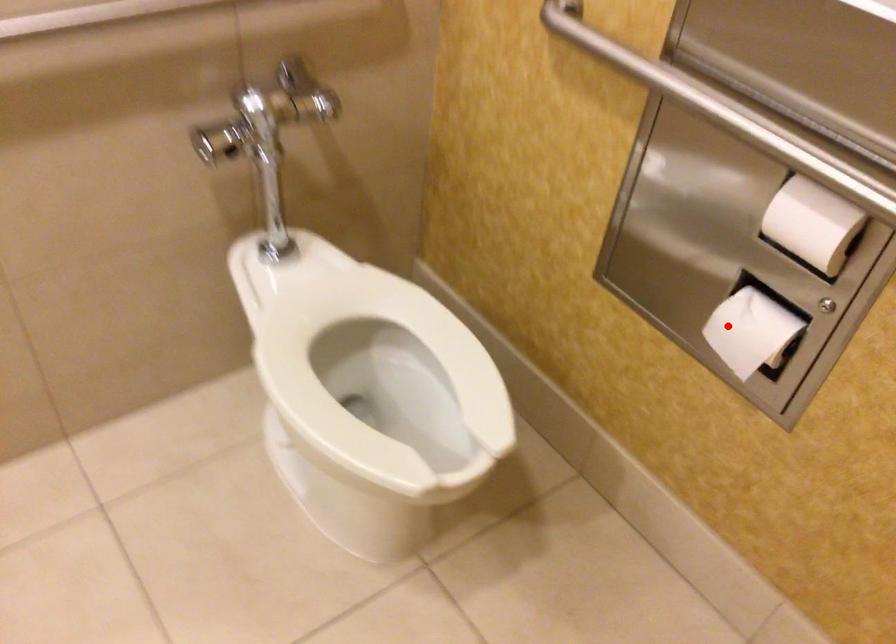
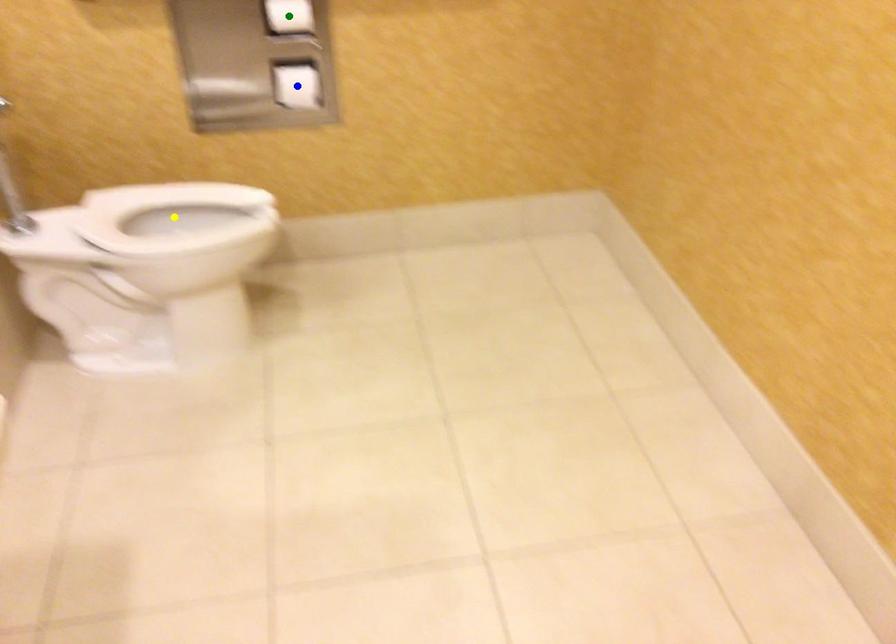
Question: I am providing you with two images of the same scene from different viewpoints. A red point is marked on the first image. You are given multiple points on the second image. Which point in image 2 represents the same 3d spot as the red point in image 1?

Choices:
 (A) green point
 (B) blue point
 (C) yellow point

Answer: (B)